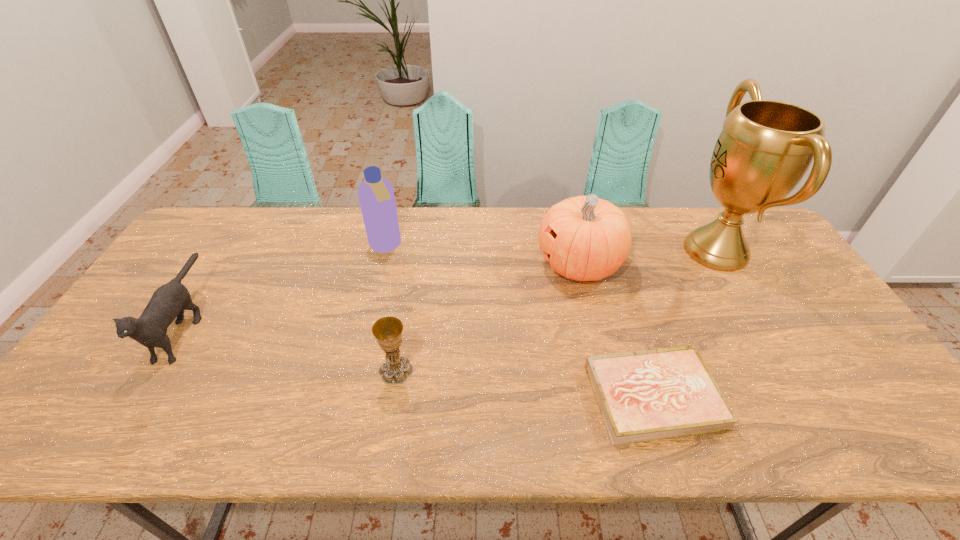
At what (x,y) coordinates should I click in order to perform the action: click on vacant space that satisfies the following two spatial constraints: 1. on the surface of the trophy cup with symbols; 2. on the front-facing side of the cat. Please return your answer as a coordinate pair (x, y). The image size is (960, 540). Looking at the image, I should click on (759, 325).

Locate an element on the screen. This screenshot has height=540, width=960. free space that satisfies the following two spatial constraints: 1. on the front-facing side of the pumpkin; 2. on the front side of the chalice is located at coordinates (605, 370).

You are a GUI agent. You are given a task and a screenshot of the screen. Output one action in this format:
    pyautogui.click(x=<x>, y=<y>)
    Task: Click on the vacant position in the image that satisfies the following two spatial constraints: 1. on the front-facing side of the pumpkin; 2. on the back side of the shortest object
    Image resolution: width=960 pixels, height=540 pixels.
    Given the screenshot: What is the action you would take?
    pyautogui.click(x=612, y=397)

This screenshot has width=960, height=540. Identify the location of vacant area that satisfies the following two spatial constraints: 1. on the front-facing side of the shortest object; 2. on the left side of the leftmost object. [x=142, y=397].

At what (x,y) coordinates should I click in order to perform the action: click on vacant area that satisfies the following two spatial constraints: 1. on the front-facing side of the shortest object; 2. on the left side of the pumpkin. Please return your answer as a coordinate pair (x, y). Looking at the image, I should click on 612,397.

Locate an element on the screen. vacant space that satisfies the following two spatial constraints: 1. on the front side of the second object from left to right; 2. on the right side of the third object from left to right is located at coordinates (356, 370).

Locate an element on the screen. Image resolution: width=960 pixels, height=540 pixels. free space that satisfies the following two spatial constraints: 1. on the front-facing side of the pumpkin; 2. on the left side of the shortest object is located at coordinates (612, 397).